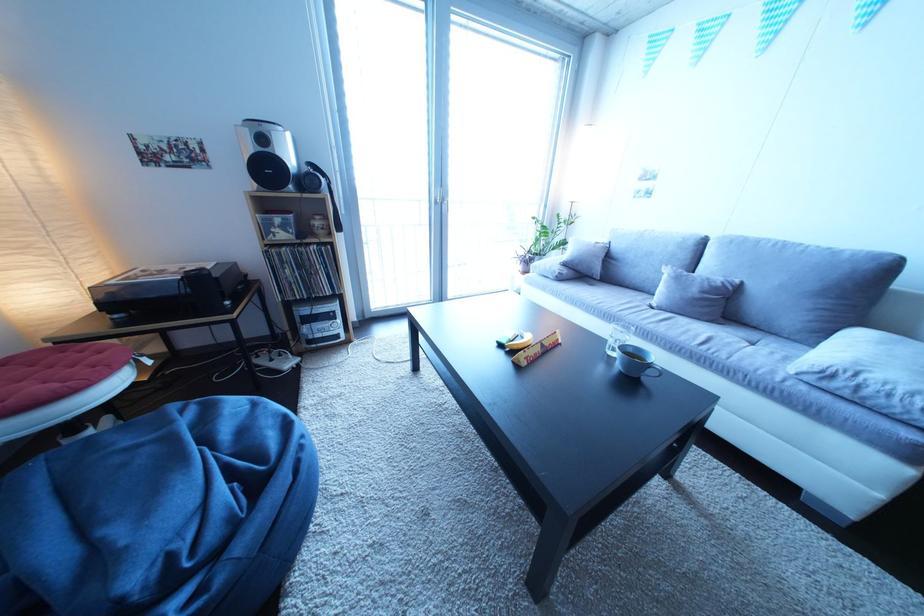
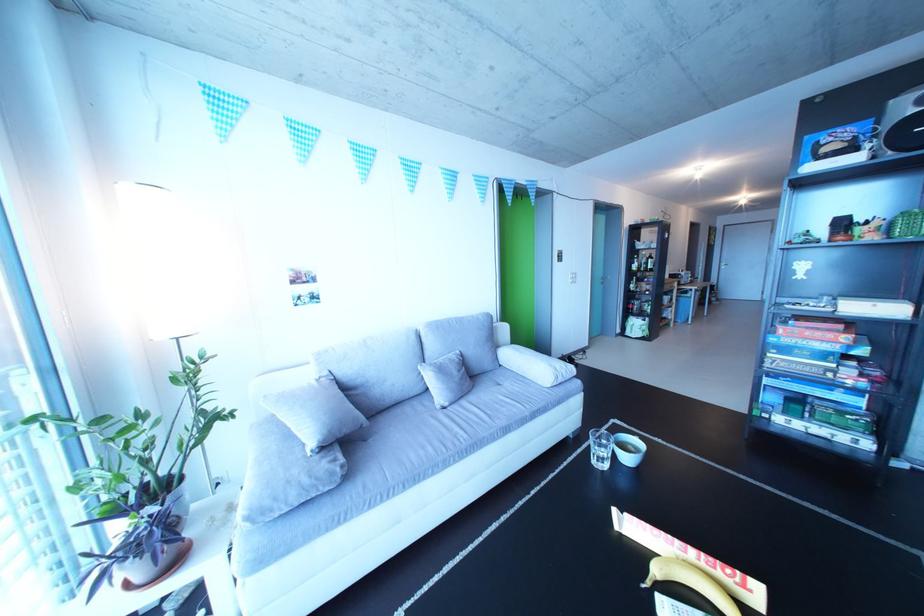
The point at (592,274) is marked in the first image. Where is the corresponding point in the second image?

(359, 437)